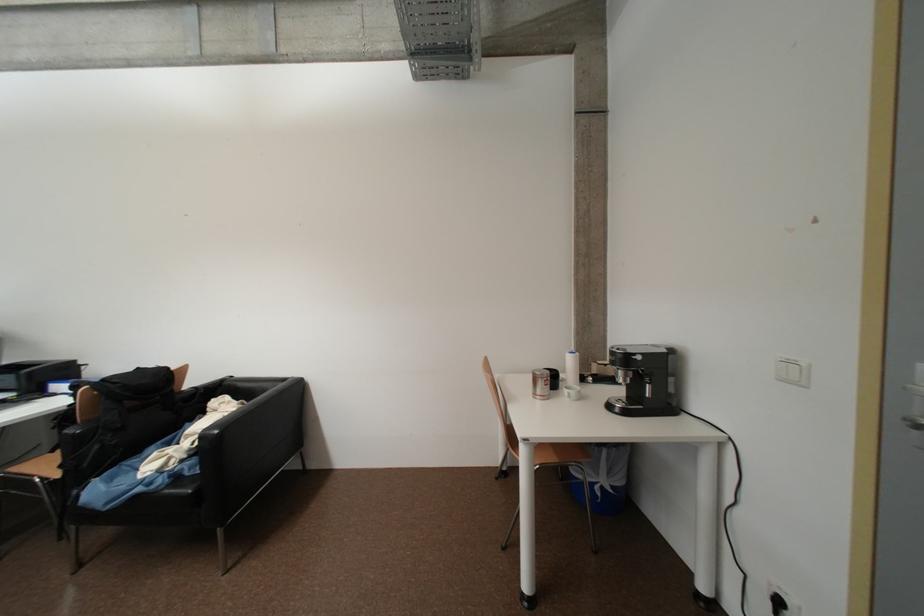
Which object does [572,368] point to?

This point indicates the white paper roll.